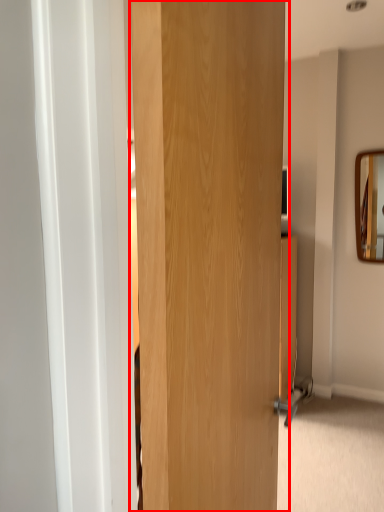
Question: In this image, where is door (annotated by the red box) located relative to mirror?

Choices:
 (A) left
 (B) right

Answer: (A)